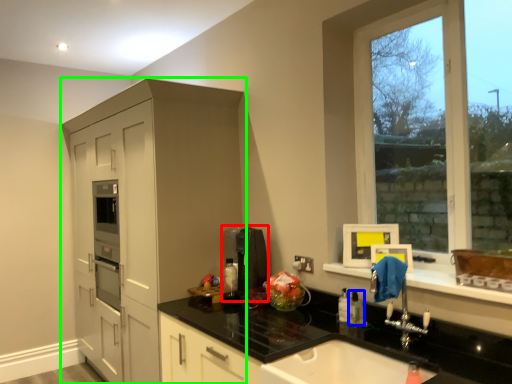
Question: Which object is positioned farthest from coffee machine (highlighted by a red box)? Select from toiletry (highlighted by a blue box) and cabinetry (highlighted by a green box).

Choices:
 (A) toiletry
 (B) cabinetry

Answer: (B)